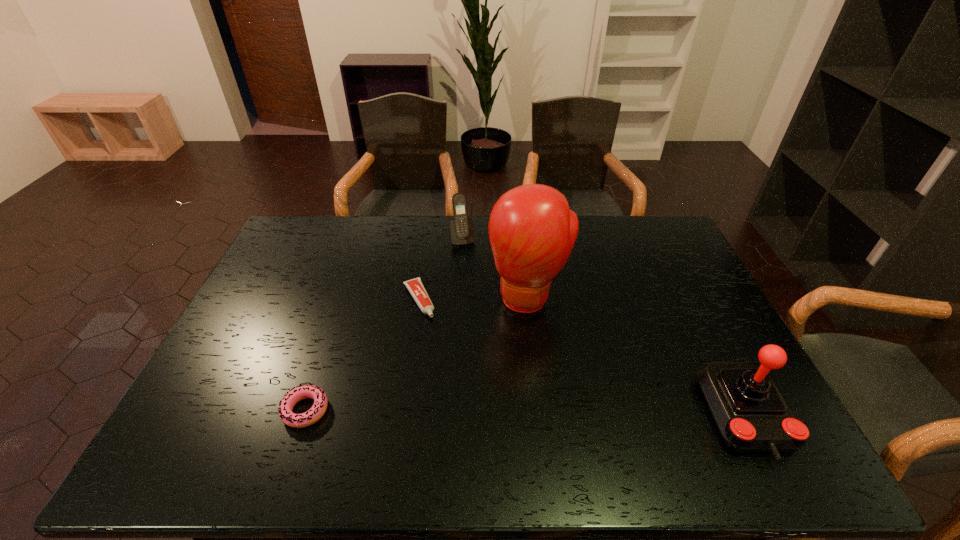
Locate an element on the screen. This screenshot has width=960, height=540. joystick present at the near edge is located at coordinates (751, 415).

Where is `object that is at the right edge`? This screenshot has height=540, width=960. object that is at the right edge is located at coordinates (751, 415).

Identify the location of object present at the near right corner. (751, 415).

The height and width of the screenshot is (540, 960). I want to click on free space at the far edge, so click(620, 235).

At what (x,y) coordinates should I click in order to perform the action: click on vacant space at the near edge of the desktop. Please return your answer as a coordinate pair (x, y). The image size is (960, 540). Looking at the image, I should click on (419, 398).

This screenshot has width=960, height=540. In order to click on vacant position at the left edge of the desktop in this screenshot , I will do `click(290, 301)`.

The image size is (960, 540). In the image, there is a desktop. What are the coordinates of `free space at the right edge` in the screenshot? It's located at (693, 350).

In the image, there is a desktop. Where is `free space at the near left corner`? Image resolution: width=960 pixels, height=540 pixels. free space at the near left corner is located at coordinates (186, 412).

Identify the location of free space at the far right corner. The width and height of the screenshot is (960, 540). (664, 217).

In the image, there is a desktop. Identify the location of vacant region at the near right corner. This screenshot has width=960, height=540. (702, 400).